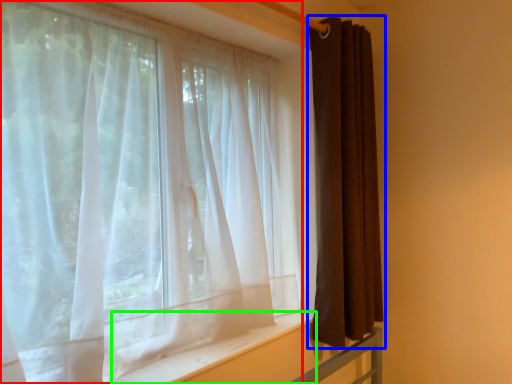
Question: Which is nearer to the curtain (highlighted by a red box)? curtain (highlighted by a blue box) or window sill (highlighted by a green box).

Choices:
 (A) curtain
 (B) window sill

Answer: (B)